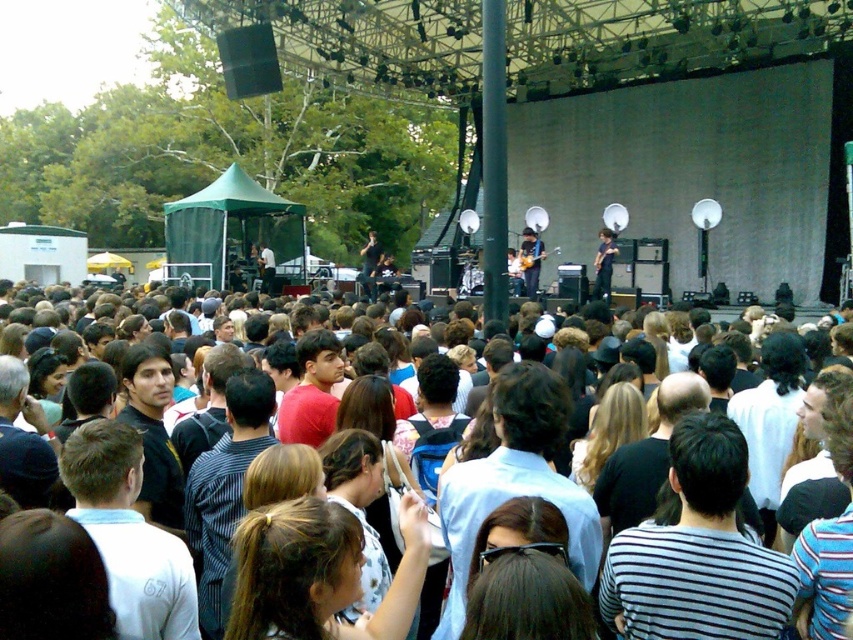
You are a photographer at the concert. You want to take a photo of the striped cotton shirt at center and the brown hair at center. Which object should you focus on first if you want to capture both in the same frame without moving the camera?

The striped cotton shirt at center is bigger than brown hair at center, so you should focus on the striped cotton shirt at center first to ensure it is in clear view before adjusting for the brown hair at center.